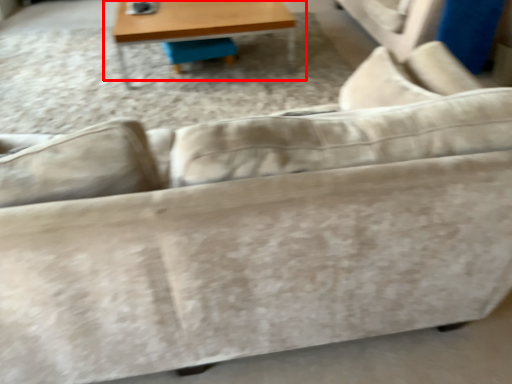
Question: In this image, where is table (annotated by the red box) located relative to swivel chair?

Choices:
 (A) left
 (B) right

Answer: (B)